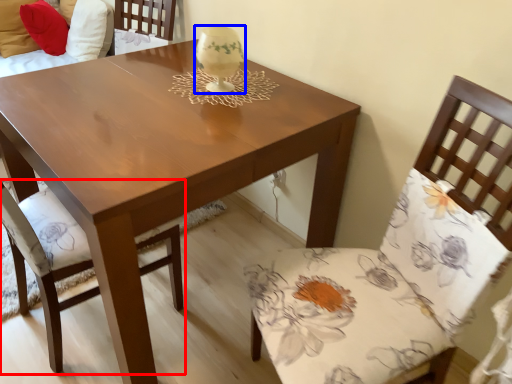
Question: Which of the following is the closest to the observer, chair (highlighted by a red box) or candle holder (highlighted by a blue box)?

Choices:
 (A) chair
 (B) candle holder

Answer: (A)